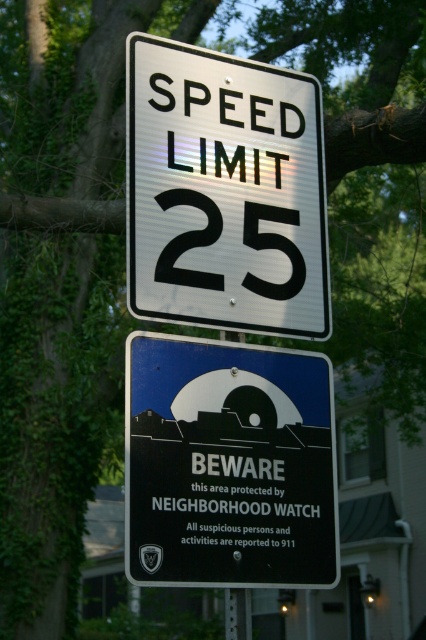
Can you confirm if white metallic speed limit sign at upper center is wider than metallic blue sign at center?

Indeed, white metallic speed limit sign at upper center has a greater width compared to metallic blue sign at center.

Which is above, white metallic speed limit sign at upper center or metallic blue sign at center?

white metallic speed limit sign at upper center is higher up.

Between point (207, 179) and point (161, 374), which one is positioned in front?

Positioned in front is point (161, 374).

You are a GUI agent. You are given a task and a screenshot of the screen. Output one action in this format:
    pyautogui.click(x=<x>, y=<y>)
    Task: Click on the white metallic speed limit sign at upper center
    The image size is (426, 640).
    Given the screenshot: What is the action you would take?
    pyautogui.click(x=224, y=193)

Does white metallic speed limit sign at upper center appear on the right side of blackmaterial/texturebeware sign at center?

No, white metallic speed limit sign at upper center is not to the right of blackmaterial/texturebeware sign at center.

Is white metallic speed limit sign at upper center thinner than blackmaterial/texturebeware sign at center?

In fact, white metallic speed limit sign at upper center might be wider than blackmaterial/texturebeware sign at center.

Describe the element at coordinates (224, 193) in the screenshot. The height and width of the screenshot is (640, 426). I see `white metallic speed limit sign at upper center` at that location.

At what (x,y) coordinates should I click in order to perform the action: click on white metallic speed limit sign at upper center. Please return your answer as a coordinate pair (x, y). Looking at the image, I should click on (224, 193).

Who is shorter, metallic blue sign at center or blackmaterial/texturebeware sign at center?

With less height is blackmaterial/texturebeware sign at center.

Is metallic blue sign at center above blackmaterial/texturebeware sign at center?

Yes, metallic blue sign at center is above blackmaterial/texturebeware sign at center.

This screenshot has height=640, width=426. What are the coordinates of `metallic blue sign at center` in the screenshot? It's located at (227, 465).

The width and height of the screenshot is (426, 640). Find the location of `metallic blue sign at center`. metallic blue sign at center is located at coordinates (227, 465).